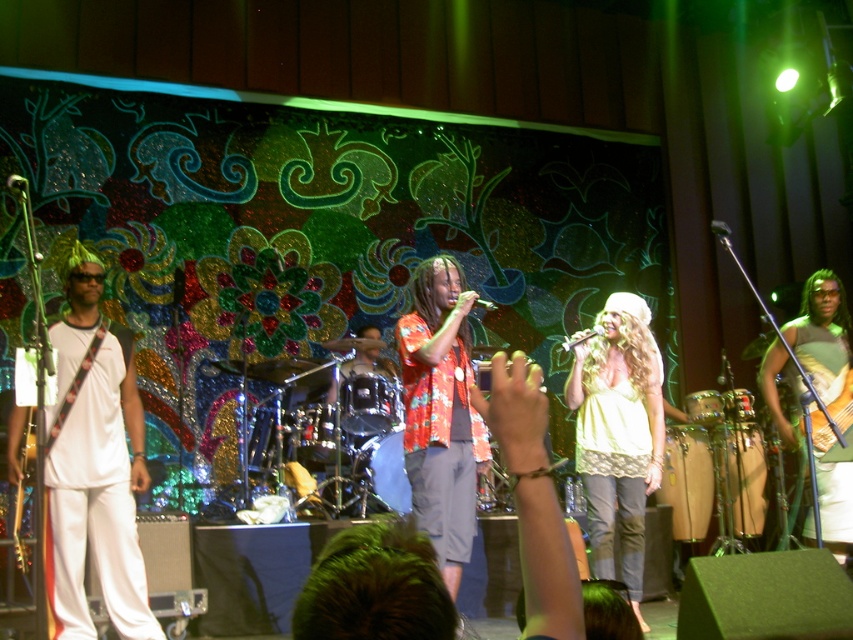
What is the position of the light yellow fabric shirt at center in the image?

The light yellow fabric shirt at center is located at point (618, 433).

You are a photographer standing at the front of the stage. You want to take a photo that includes both the point at position [645,422] and the point at position [827,488]. Based on their positions, which point should be closer to the camera?

Point [827,488] is closer to the camera because point [645,422] is behind it.